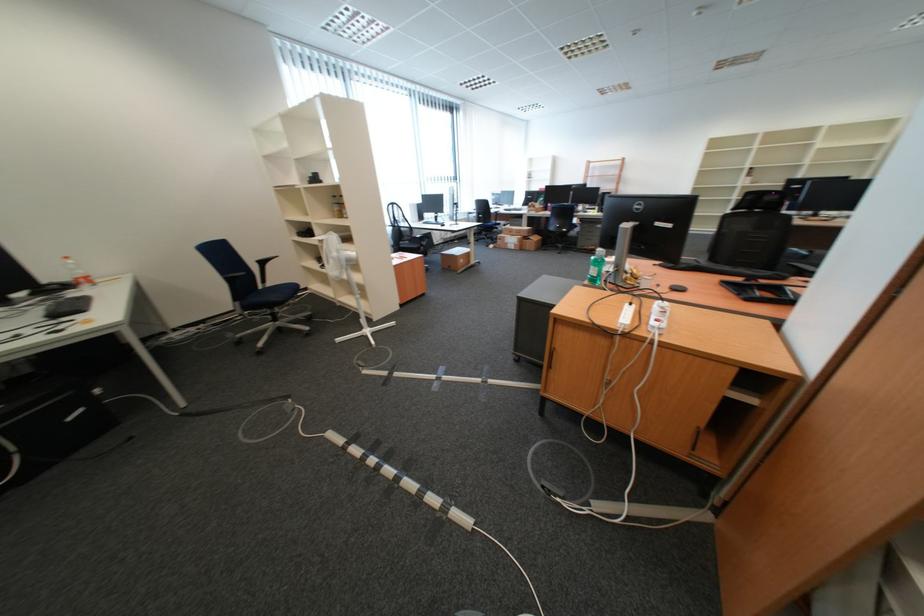
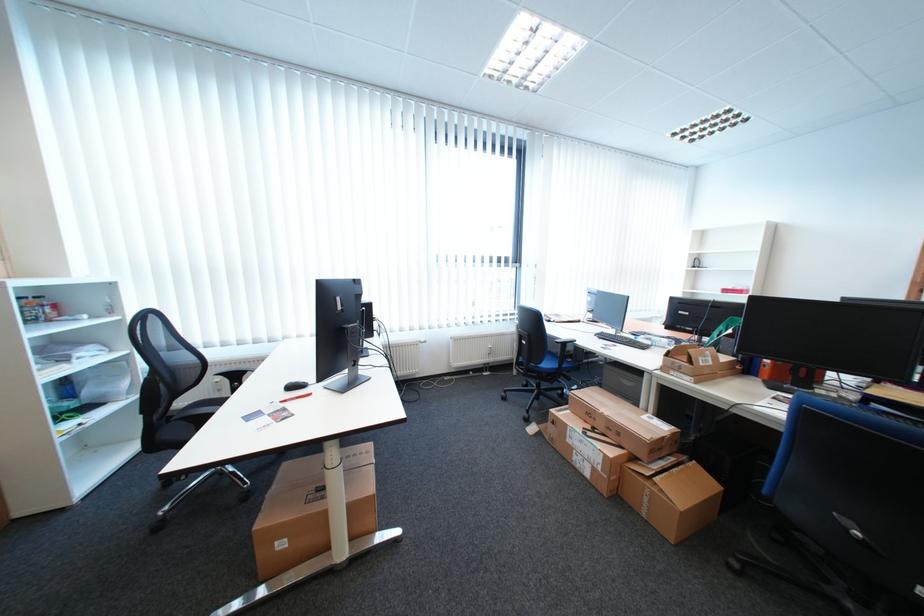
Where in the second image is the point corresponding to point (473, 262) from the first image?

(294, 546)